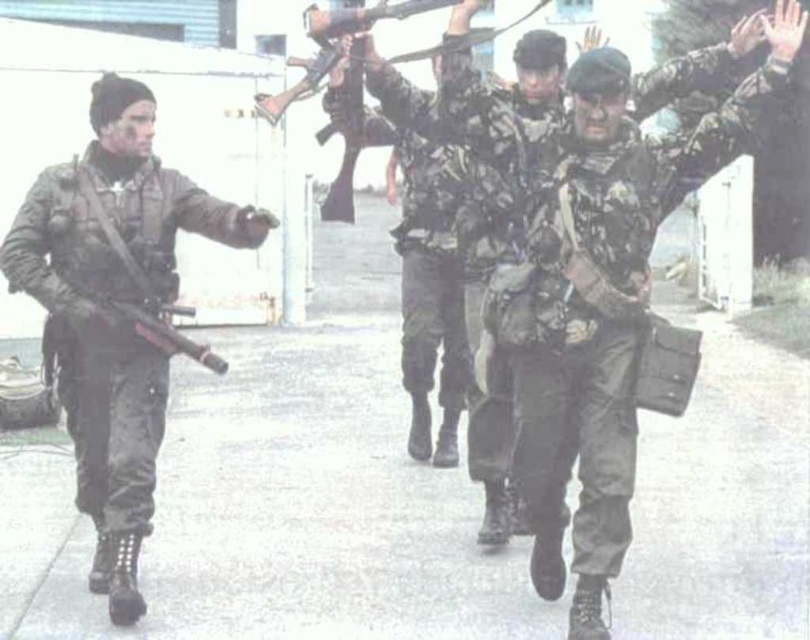
You are a drone operator trying to capture two specific points in the scene. The first point is at coordinate point(126, 609) and the second is at point(578, 381). Which point is closer to your drone camera?

Point(126, 609) is closer to the drone camera because it is further to the viewer than point(578, 381).

You are a photographer trying to capture a closeup of the camouflage uniform at left and camouflage fabric uniform at center. Which one should you zoom in on if you want to focus on the taller one?

The camouflage uniform at left is taller than the camouflage fabric uniform at center, so you should zoom in on the camouflage uniform at left.